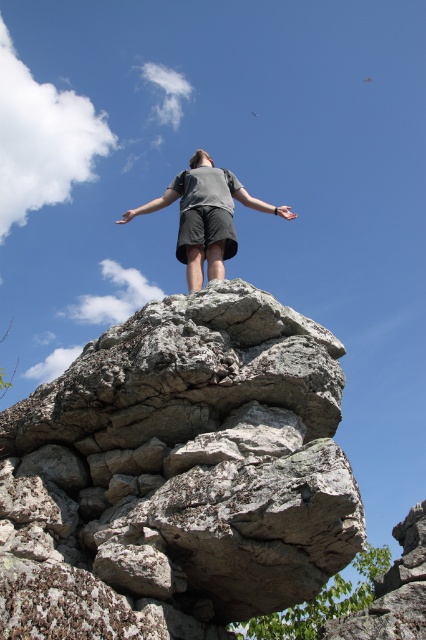
Can you confirm if gray rough rock at center is thinner than gray matte shorts at center?

Yes, gray rough rock at center is thinner than gray matte shorts at center.

Looking at this image, is gray rough rock at center to the left of gray matte shorts at center from the viewer's perspective?

Yes, gray rough rock at center is to the left of gray matte shorts at center.

Is point (244, 520) positioned before point (126, 218)?

Yes, point (244, 520) is closer to viewer.

This screenshot has width=426, height=640. What are the coordinates of `gray rough rock at center` in the screenshot? It's located at point(178,474).